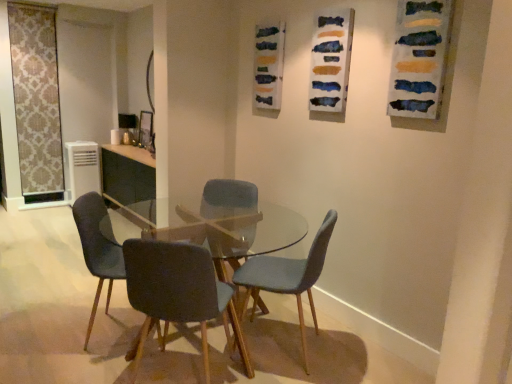
At what (x,y) coordinates should I click in order to perform the action: click on vacant area that is situated to the right of matte blue fabric chair at center, which is the 1th chair from right to left. Please return your answer as a coordinate pair (x, y). This screenshot has height=384, width=512. Looking at the image, I should click on (361, 357).